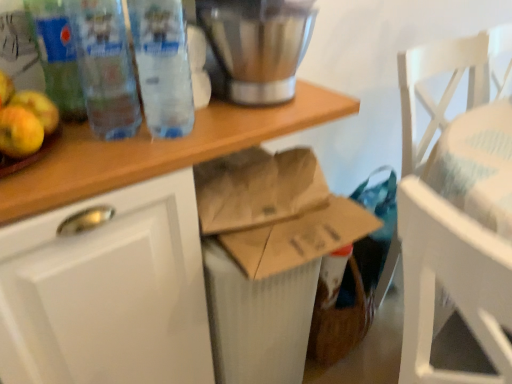
Find the location of `empty space that is to the right of transparent plastic bottle at upper left, the 2th bottle in the right-to-left sequence`. empty space that is to the right of transparent plastic bottle at upper left, the 2th bottle in the right-to-left sequence is located at coordinates (210, 128).